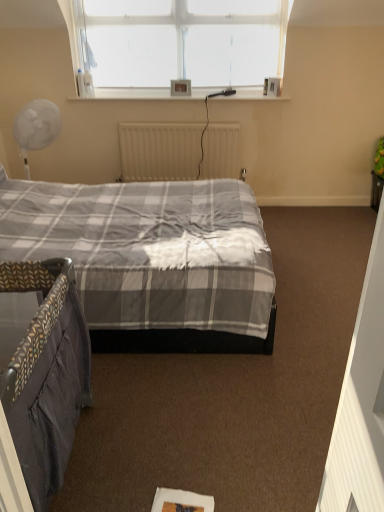
This screenshot has height=512, width=384. In order to click on white matte radiator at center in this screenshot , I will do `click(178, 151)`.

The width and height of the screenshot is (384, 512). In order to click on dark grey fabric crib at lower left in this screenshot , I will do `click(43, 369)`.

This screenshot has height=512, width=384. Describe the element at coordinates (43, 369) in the screenshot. I see `dark grey fabric crib at lower left` at that location.

This screenshot has width=384, height=512. What do you see at coordinates (181, 87) in the screenshot?
I see `matte plastic picture frame at upper center` at bounding box center [181, 87].

Locate an element on the screen. The image size is (384, 512). white matte radiator at center is located at coordinates (178, 151).

In the image, is dark grey fabric crib at lower left on the left side or the right side of matte plastic picture frame at upper center?

From the image, it's evident that dark grey fabric crib at lower left is to the left of matte plastic picture frame at upper center.

Looking at this image, from a real-world perspective, does dark grey fabric crib at lower left stand above matte plastic picture frame at upper center?

No, from a real-world perspective, dark grey fabric crib at lower left is not on top of matte plastic picture frame at upper center.

Where is `picture frame lying above the dark grey fabric crib at lower left (from the image's perspective)`? This screenshot has width=384, height=512. picture frame lying above the dark grey fabric crib at lower left (from the image's perspective) is located at coordinates (181, 87).

Between dark grey fabric crib at lower left and matte plastic picture frame at upper center, which one has less height?

Standing shorter between the two is matte plastic picture frame at upper center.

Is dark grey fabric crib at lower left at the back of white matte radiator at center?

That's not correct — white matte radiator at center is not looking away from dark grey fabric crib at lower left.

Find the location of a particular element. This screenshot has width=384, height=512. radiator positioned vertically above the dark grey fabric crib at lower left (from a real-world perspective) is located at coordinates (178, 151).

In the image, is white matte radiator at center on the left side or the right side of dark grey fabric crib at lower left?

white matte radiator at center is to the right of dark grey fabric crib at lower left.

Who is smaller, dark grey fabric crib at lower left or white matte radiator at center?

white matte radiator at center.

Is point (68, 431) closer to camera compared to point (226, 177)?

That is True.

What's the angular difference between dark grey fabric crib at lower left and white matte radiator at center's facing directions?

180 degrees.

Is dark grey fabric crib at lower left in front of or behind white matte radiator at center in the image?

Visually, dark grey fabric crib at lower left is located in front of white matte radiator at center.

Is white matte radiator at center oriented away from matte plastic picture frame at upper center?

white matte radiator at center is not turned away from matte plastic picture frame at upper center.

Considering the sizes of objects white matte radiator at center and matte plastic picture frame at upper center in the image provided, who is smaller, white matte radiator at center or matte plastic picture frame at upper center?

matte plastic picture frame at upper center.

From a real-world perspective, is white matte radiator at center over matte plastic picture frame at upper center?

Actually, white matte radiator at center is physically below matte plastic picture frame at upper center in the real world.

Can you confirm if matte plastic picture frame at upper center is smaller than dark grey fabric crib at lower left?

Yes, matte plastic picture frame at upper center is smaller than dark grey fabric crib at lower left.

From a real-world perspective, between matte plastic picture frame at upper center and dark grey fabric crib at lower left, who is vertically lower?

From a 3D spatial view, dark grey fabric crib at lower left is below.

Is point (176, 83) closer to viewer compared to point (73, 342)?

No, (176, 83) is behind (73, 342).

From the image's perspective, is matte plastic picture frame at upper center on dark grey fabric crib at lower left?

Yes, from the image's perspective, matte plastic picture frame at upper center is above dark grey fabric crib at lower left.

From the image's perspective, is matte plastic picture frame at upper center positioned above or below white matte radiator at center?

Clearly, from the image's perspective, matte plastic picture frame at upper center is above white matte radiator at center.

Based on the photo, is matte plastic picture frame at upper center thinner than white matte radiator at center?

Yes, matte plastic picture frame at upper center is thinner than white matte radiator at center.

How many degrees apart are the facing directions of matte plastic picture frame at upper center and white matte radiator at center?

0.597 degrees separate the facing orientations of matte plastic picture frame at upper center and white matte radiator at center.

Identify the location of bed on the left of the matte plastic picture frame at upper center. This screenshot has width=384, height=512. (x=43, y=369).

Where is `radiator located above the dark grey fabric crib at lower left (from a real-world perspective)`? radiator located above the dark grey fabric crib at lower left (from a real-world perspective) is located at coordinates (178, 151).

When comparing their distances from white matte radiator at center, does matte plastic picture frame at upper center or dark grey fabric crib at lower left seem closer?

matte plastic picture frame at upper center is closer to white matte radiator at center.

Considering their positions, is dark grey fabric crib at lower left positioned further to white matte radiator at center than matte plastic picture frame at upper center?

dark grey fabric crib at lower left is further to white matte radiator at center.

Based on their spatial positions, is dark grey fabric crib at lower left or white matte radiator at center closer to matte plastic picture frame at upper center?

Among the two, white matte radiator at center is located nearer to matte plastic picture frame at upper center.

Which object lies nearer to the anchor point matte plastic picture frame at upper center, white matte radiator at center or dark grey fabric crib at lower left?

The object closer to matte plastic picture frame at upper center is white matte radiator at center.

Which object lies nearer to the anchor point dark grey fabric crib at lower left, white matte radiator at center or matte plastic picture frame at upper center?

Based on the image, white matte radiator at center appears to be nearer to dark grey fabric crib at lower left.

Estimate the real-world distances between objects in this image. Which object is closer to dark grey fabric crib at lower left, matte plastic picture frame at upper center or white matte radiator at center?

white matte radiator at center lies closer to dark grey fabric crib at lower left than the other object.

You are a GUI agent. You are given a task and a screenshot of the screen. Output one action in this format:
    pyautogui.click(x=<x>, y=<y>)
    Task: Click on the picture frame between dark grey fabric crib at lower left and white matte radiator at center from front to back
    
    Given the screenshot: What is the action you would take?
    pyautogui.click(x=181, y=87)